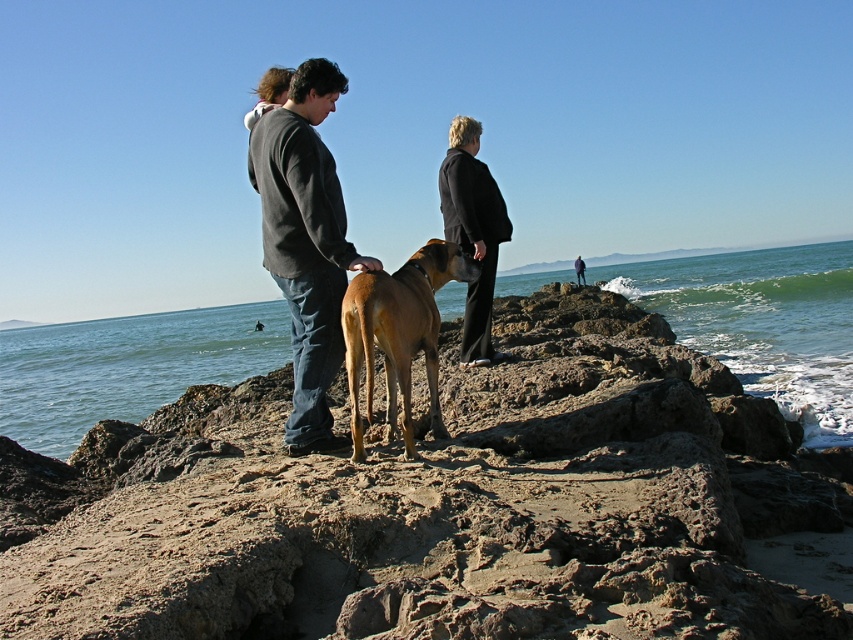
Does point (316, 509) come farther from viewer compared to point (677, 312)?

No, (316, 509) is in front of (677, 312).

Is point (544, 481) less distant than point (114, 330)?

Yes.

Identify the location of brown rock at center. (437, 506).

Consider the image. Is brown fur dog at center shorter than black wool coat at center?

Indeed, brown fur dog at center has a lesser height compared to black wool coat at center.

I want to click on brown fur dog at center, so click(x=398, y=333).

Does brown rock at center have a lesser height compared to black wool coat at center?

Correct, brown rock at center is not as tall as black wool coat at center.

Which is below, brown rock at center or black wool coat at center?

brown rock at center is lower down.

Does point (223, 440) lie in front of point (480, 227)?

Yes.

The width and height of the screenshot is (853, 640). What are the coordinates of `brown rock at center` in the screenshot? It's located at (437, 506).